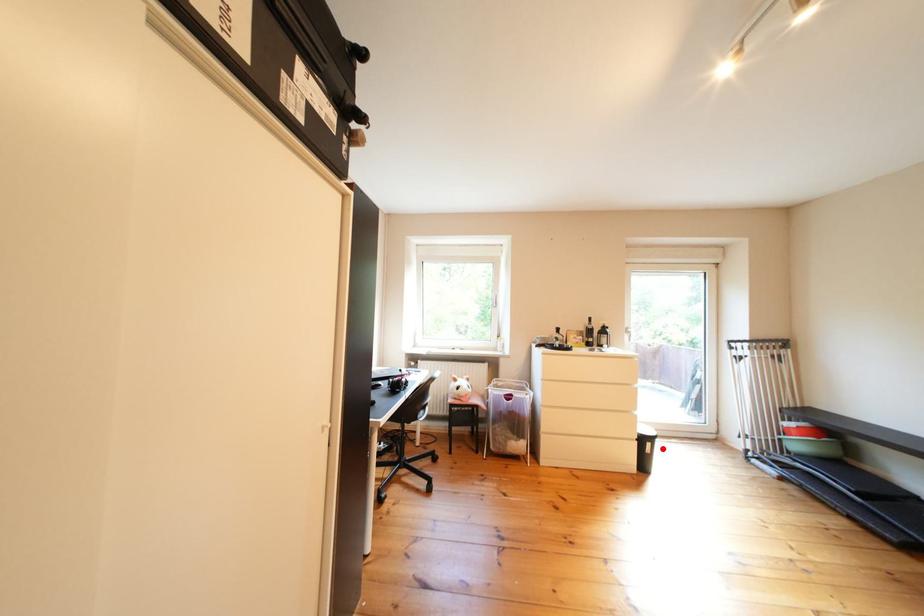
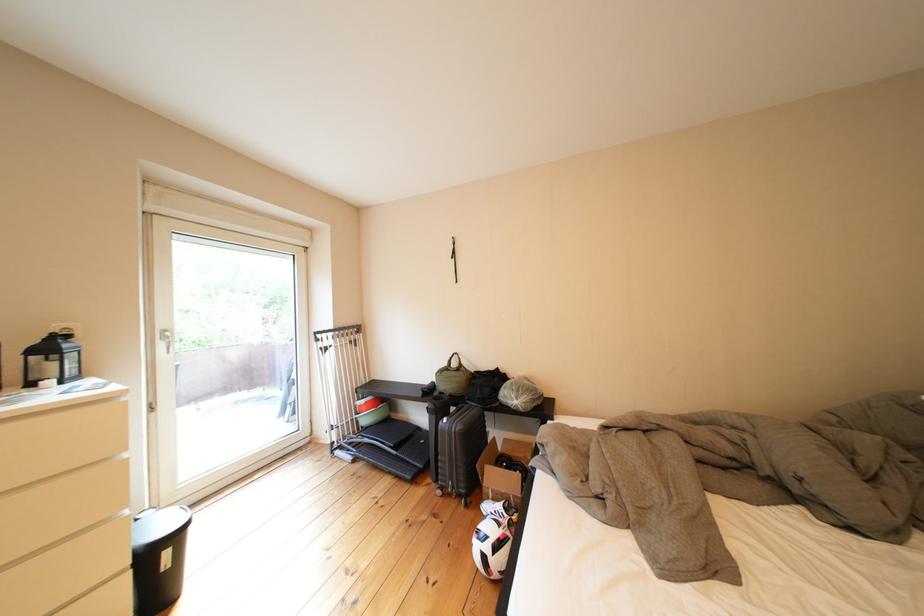
Question: I am providing you with two images of the same scene from different viewpoints. In image1, a red point is highlighted. Considering the same 3D point in image2, which of the following is correct?

Choices:
 (A) It is closer
 (B) It is farther

Answer: (A)